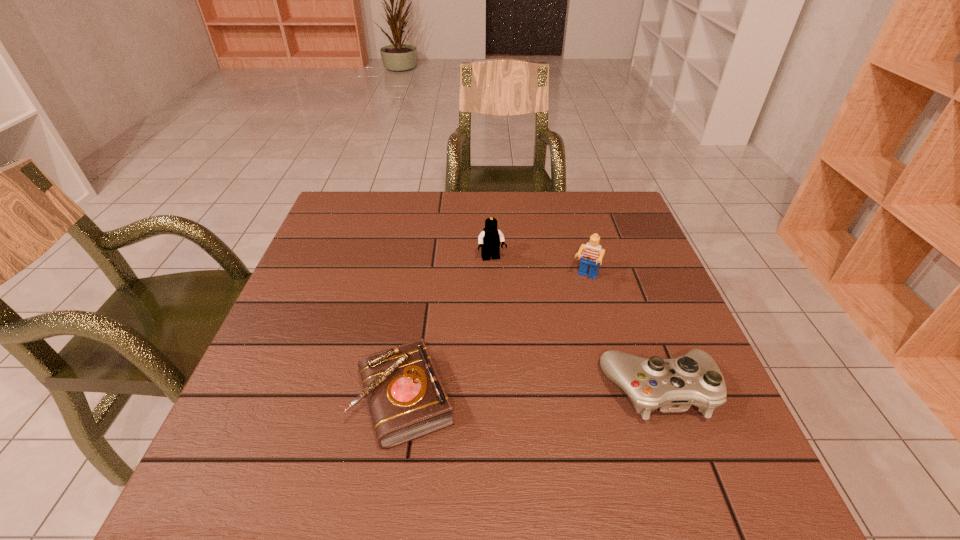
The height and width of the screenshot is (540, 960). I want to click on the shortest object, so click(x=407, y=400).

Identify the location of the leftmost object. (407, 400).

Where is `control`? control is located at coordinates (672, 385).

Find the location of a particular element. The width and height of the screenshot is (960, 540). the farther Lego is located at coordinates (489, 240).

The height and width of the screenshot is (540, 960). Identify the location of the second object from left to right. 489,240.

Identify the location of the right Lego. click(592, 256).

Locate an element on the screen. This screenshot has height=540, width=960. the third nearest object is located at coordinates (592, 256).

Locate an element on the screen. vacant space located on the left of the diary is located at coordinates (307, 399).

Image resolution: width=960 pixels, height=540 pixels. What are the coordinates of `free spot located on the left of the second shortest object` in the screenshot? It's located at (479, 390).

You are a GUI agent. You are given a task and a screenshot of the screen. Output one action in this format:
    pyautogui.click(x=<x>, y=<y>)
    Task: Click on the vacant space located 0.190m on the front-facing side of the farthest object
    
    Given the screenshot: What is the action you would take?
    pyautogui.click(x=512, y=318)